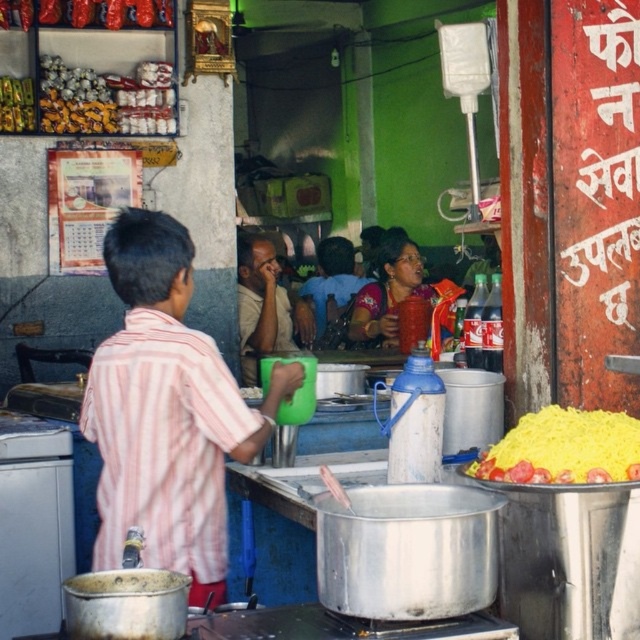
Question: Which point is farther to the camera?

Choices:
 (A) (273, 289)
 (B) (572, 417)

Answer: (A)

Question: Estimate the real-world distances between objects in this image. Which object is closer to the matte plastic cup at center?

Choices:
 (A) matte beige shirt at center
 (B) yellow rice at right

Answer: (A)

Question: Is yellow rice at right to the left of matte beige shirt at center from the viewer's perspective?

Choices:
 (A) no
 (B) yes

Answer: (A)

Question: Can you confirm if yellow rice at right is thinner than matte beige shirt at center?

Choices:
 (A) yes
 (B) no

Answer: (B)

Question: Which point is farther to the camera?

Choices:
 (A) yellow rice at right
 (B) matte plastic cup at center

Answer: (B)

Question: Is matte beige shirt at center bigger than matte plastic cup at center?

Choices:
 (A) no
 (B) yes

Answer: (A)